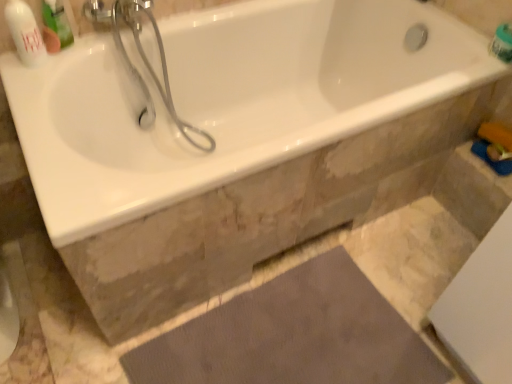
Question: From a real-world perspective, is green plastic container at upper right, the 1th toiletry in the right-to-left sequence, located higher than white glossy bottle at upper left, placed as the 2th toiletry when sorted from back to front?

Choices:
 (A) no
 (B) yes

Answer: (A)

Question: Is green plastic container at upper right, which is the second toiletry in front-to-back order, closer to the viewer compared to white glossy bottle at upper left, the first toiletry when ordered from front to back?

Choices:
 (A) yes
 (B) no

Answer: (B)

Question: Does green plastic container at upper right, which is the first toiletry from back to front, have a lesser width compared to white glossy bottle at upper left, the first toiletry positioned from the left?

Choices:
 (A) yes
 (B) no

Answer: (B)

Question: Does green plastic container at upper right, which is the second toiletry in front-to-back order, have a smaller size compared to white glossy bottle at upper left, the first toiletry when ordered from front to back?

Choices:
 (A) yes
 (B) no

Answer: (A)

Question: Can you confirm if green plastic container at upper right, which is the first toiletry from back to front, is positioned to the left of white glossy bottle at upper left, the first toiletry when ordered from front to back?

Choices:
 (A) no
 (B) yes

Answer: (A)

Question: From a real-world perspective, relative to brown textured mat at lower center, is white glossy bathtub at upper center vertically above or below?

Choices:
 (A) above
 (B) below

Answer: (A)

Question: Considering their positions, is white glossy bathtub at upper center located in front of or behind brown textured mat at lower center?

Choices:
 (A) behind
 (B) front

Answer: (B)

Question: Looking at their shapes, would you say white glossy bathtub at upper center is wider or thinner than brown textured mat at lower center?

Choices:
 (A) thin
 (B) wide

Answer: (B)

Question: Is white glossy bathtub at upper center inside or outside of brown textured mat at lower center?

Choices:
 (A) outside
 (B) inside

Answer: (A)

Question: Relative to green plastic mouthwash at upper left, is brown textured mat at lower center in front or behind?

Choices:
 (A) front
 (B) behind

Answer: (A)

Question: From a real-world perspective, relative to green plastic mouthwash at upper left, is brown textured mat at lower center vertically above or below?

Choices:
 (A) above
 (B) below

Answer: (B)

Question: Based on their sizes in the image, would you say brown textured mat at lower center is bigger or smaller than green plastic mouthwash at upper left?

Choices:
 (A) small
 (B) big

Answer: (B)

Question: Is brown textured mat at lower center taller or shorter than green plastic mouthwash at upper left?

Choices:
 (A) short
 (B) tall

Answer: (A)

Question: In the image, is brown textured mat at lower center on the left side or the right side of green plastic container at upper right, which is the first toiletry from back to front?

Choices:
 (A) left
 (B) right

Answer: (A)

Question: From a real-world perspective, relative to green plastic container at upper right, which is the first toiletry from back to front, is brown textured mat at lower center vertically above or below?

Choices:
 (A) above
 (B) below

Answer: (B)